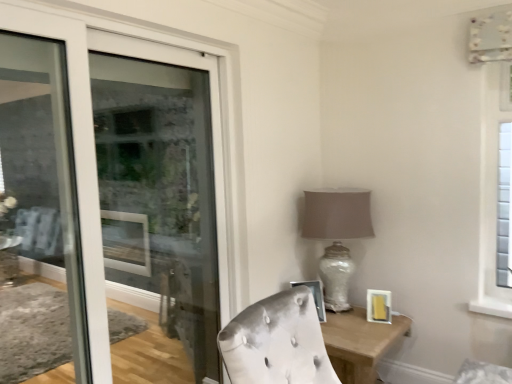
Question: Considering the positions of matte glass door at left and matte glass table lamp at center-right in the image, is matte glass door at left wider or thinner than matte glass table lamp at center-right?

Choices:
 (A) thin
 (B) wide

Answer: (A)

Question: In the image, is matte glass door at left positioned in front of or behind matte glass table lamp at center-right?

Choices:
 (A) front
 (B) behind

Answer: (A)

Question: Based on their relative distances, which object is nearer to the metallic silver picture frame at center, which is the 1th picture frame in left-to-right order?

Choices:
 (A) wooden table at lower right
 (B) matte gold picture frame at lower right, which is the 1th picture frame from right to left
 (C) matte glass door at left
 (D) matte glass table lamp at center-right

Answer: (A)

Question: Which object is positioned farthest from the matte glass table lamp at center-right?

Choices:
 (A) wooden table at lower right
 (B) matte glass door at left
 (C) metallic silver picture frame at center, arranged as the 2th picture frame when viewed from the right
 (D) matte gold picture frame at lower right, which is the 1th picture frame from right to left

Answer: (B)